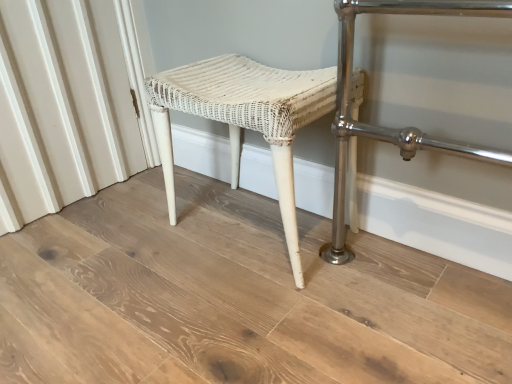
Where is `free region on the left part of white wicker stool at center`? free region on the left part of white wicker stool at center is located at coordinates (139, 241).